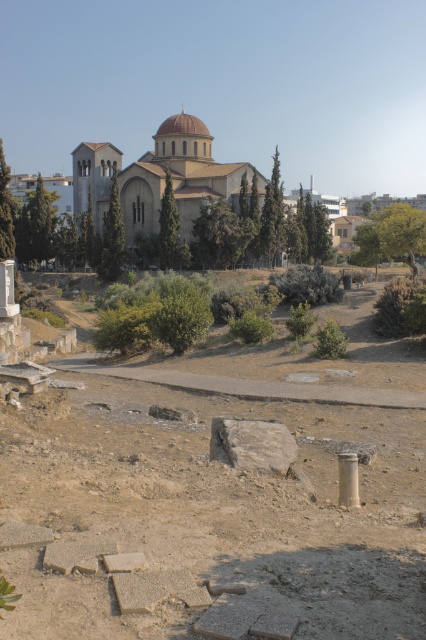
Question: Among these points, which one is nearest to the camera?

Choices:
 (A) (316, 557)
 (B) (106, 170)

Answer: (A)

Question: Is brown stone ruins at center to the right of beige stone church at center from the viewer's perspective?

Choices:
 (A) no
 (B) yes

Answer: (B)

Question: Which object is positioned farthest from the brown stone ruins at center?

Choices:
 (A) silver metallic pillar at lower right
 (B) beige stone church at center

Answer: (B)

Question: From the image, what is the correct spatial relationship of beige stone church at center in relation to silver metallic pillar at lower right?

Choices:
 (A) above
 (B) below

Answer: (A)

Question: Based on their relative distances, which object is nearer to the silver metallic pillar at lower right?

Choices:
 (A) brown stone ruins at center
 (B) beige stone church at center

Answer: (A)

Question: Is brown stone ruins at center smaller than beige stone church at center?

Choices:
 (A) no
 (B) yes

Answer: (B)